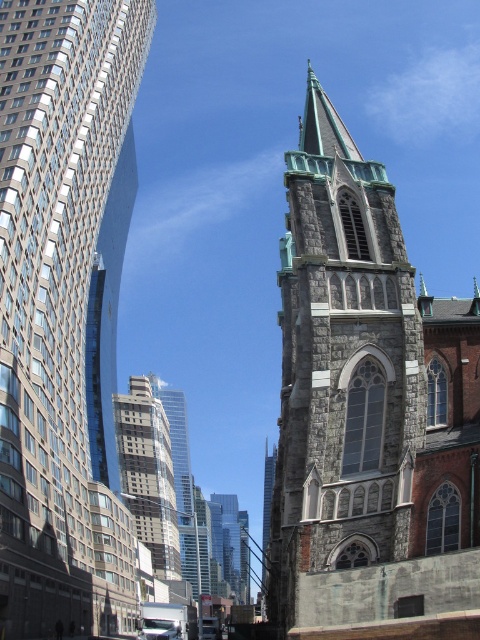
In the scene shown: You are an architect analyzing the spatial layout of this historic and modern area. You observe the gray stone church steeple at center and the gray stone church steeple at right. Which steeple appears wider from your viewpoint?

The gray stone church steeple at center appears wider than the gray stone church steeple at right because its width surpasses the other.

You are a photographer planning to capture both the gray stone church steeple at center and the gray stone church steeple at right in a single frame. Based on their positions, which steeple should you focus on first to ensure both are in the shot?

The gray stone church steeple at center is below the gray stone church steeple at right, so you should focus on the lower steeple first to ensure both are in the frame.